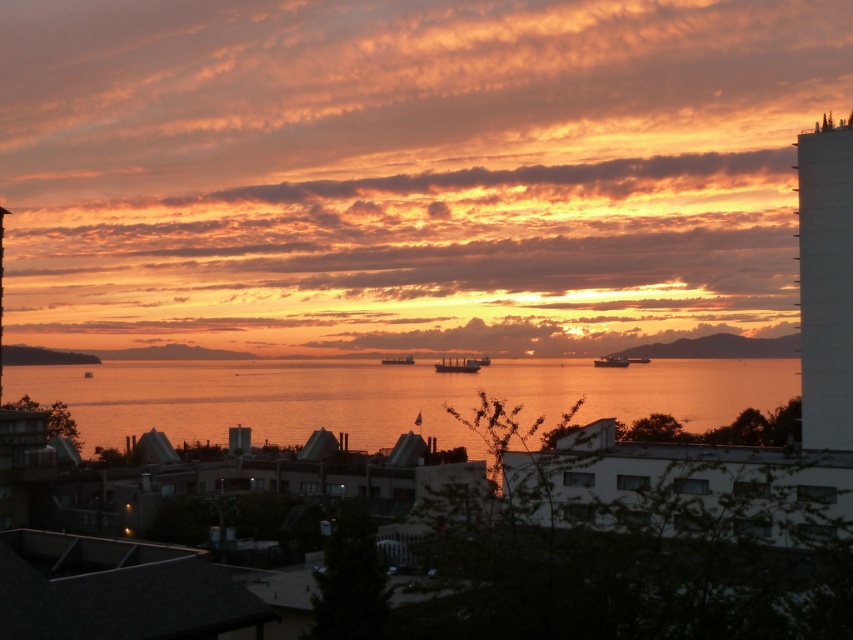
Question: Is white smooth tower at right positioned behind metallic silver ship at center?

Choices:
 (A) yes
 (B) no

Answer: (B)

Question: Considering the real-world distances, which object is farthest from the smooth concrete tower at upper left?

Choices:
 (A) metallic gray ship at center
 (B) white smooth tower at right
 (C) metallic gray cargo ship at center
 (D) golden reflective water at center

Answer: (A)

Question: Observing the image, what is the correct spatial positioning of smooth metallic ship at center in reference to metallic silver ship at center?

Choices:
 (A) below
 (B) above

Answer: (A)

Question: Based on their relative distances, which object is farther from the smooth concrete tower at upper left?

Choices:
 (A) smooth metallic ship at center
 (B) metallic silver ship at center

Answer: (B)

Question: Can you confirm if metallic gray cargo ship at center is positioned below metallic silver ship at center?

Choices:
 (A) yes
 (B) no

Answer: (A)

Question: Which object is the farthest from the white smooth tower at right?

Choices:
 (A) metallic gray ship at center
 (B) smooth metallic ship at center

Answer: (B)